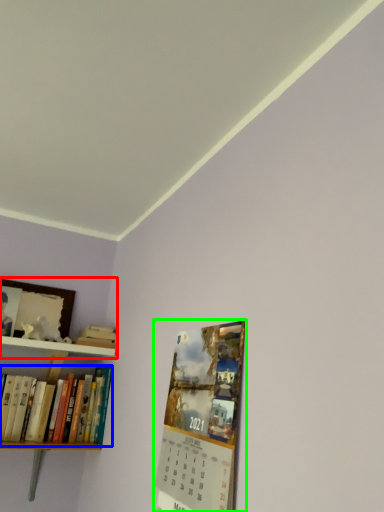
Question: Which object is the closest to the shelf (highlighted by a red box)? Choose among these: book (highlighted by a blue box) or magazine (highlighted by a green box).

Choices:
 (A) book
 (B) magazine

Answer: (A)